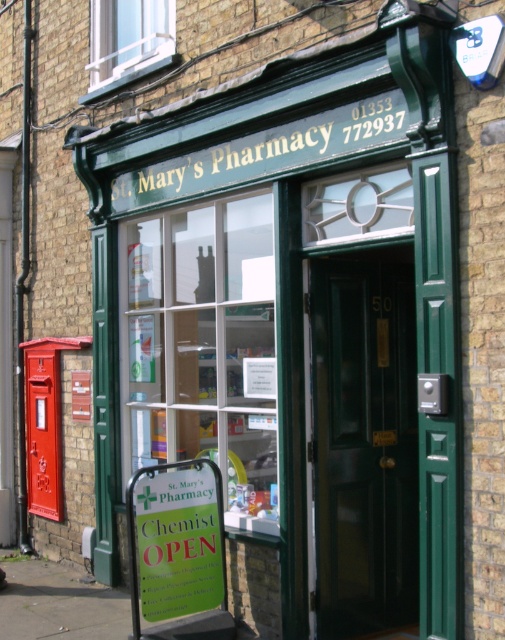
Does shiny dark wood door at center have a lesser height compared to green paper sign at lower center?

In fact, shiny dark wood door at center may be taller than green paper sign at lower center.

Is shiny dark wood door at center above green paper sign at lower center?

Yes.

Is point (362, 524) positioned after point (186, 552)?

Yes.

The width and height of the screenshot is (505, 640). Identify the location of shiny dark wood door at center. (363, 442).